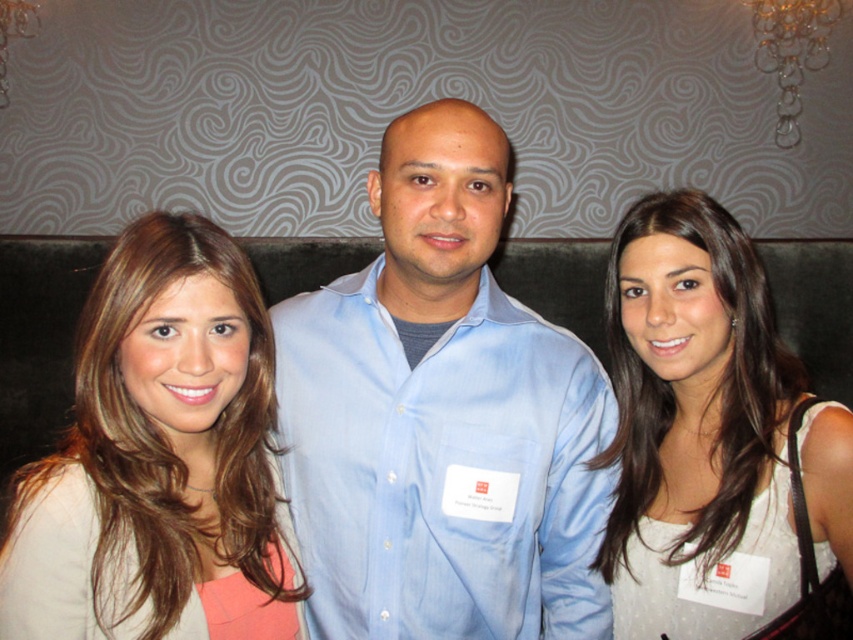
Question: Does blonde hair at center lie behind white satin dress at center?

Choices:
 (A) yes
 (B) no

Answer: (B)

Question: Estimate the real-world distances between objects in this image. Which object is farther from the light blue shirt at center?

Choices:
 (A) blonde hair at center
 (B) white satin dress at center

Answer: (A)

Question: Which object is positioned farthest from the blonde hair at center?

Choices:
 (A) white satin dress at center
 (B) light blue shirt at center

Answer: (A)

Question: Which point is closer to the camera taking this photo?

Choices:
 (A) (485, 298)
 (B) (165, 554)
 (C) (676, 440)

Answer: (B)

Question: Can you confirm if blonde hair at center is bigger than white satin dress at center?

Choices:
 (A) no
 (B) yes

Answer: (A)

Question: Is light blue shirt at center wider than white satin dress at center?

Choices:
 (A) no
 (B) yes

Answer: (B)